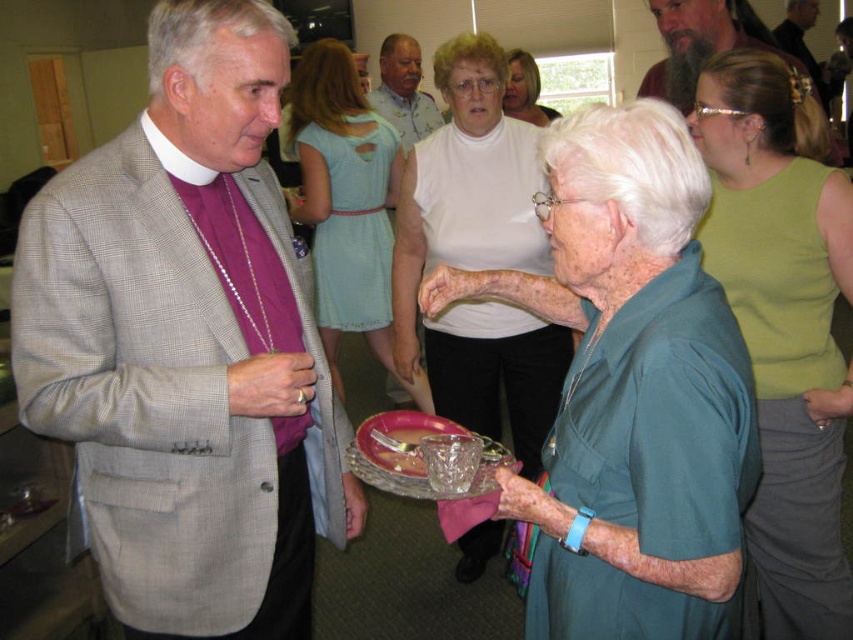
Which is in front, point (109, 371) or point (335, 148)?

Positioned in front is point (109, 371).

Is plaid wool suit at center taller than light blue fabric dress at center?

No, plaid wool suit at center is not taller than light blue fabric dress at center.

Does point (280, 330) come farther from viewer compared to point (350, 100)?

That is False.

Locate an element on the screen. This screenshot has width=853, height=640. plaid wool suit at center is located at coordinates (187, 346).

Who is more distant from viewer, (236, 113) or (529, 86)?

Point (529, 86)

Consider the image. Can you confirm if plaid wool suit at center is thinner than white t-shirt at center?

No, plaid wool suit at center is not thinner than white t-shirt at center.

Between point (265, 92) and point (526, 120), which one is positioned behind?

The point (526, 120) is more distant.

The image size is (853, 640). I want to click on plaid wool suit at center, so click(x=187, y=346).

Is bearded man at upper center positioned in front of black leather jacket at upper right?

Yes.

Which is behind, point (671, 29) or point (784, 44)?

The point (784, 44) is behind.

Identify the location of bearded man at upper center. The image size is (853, 640). (700, 42).